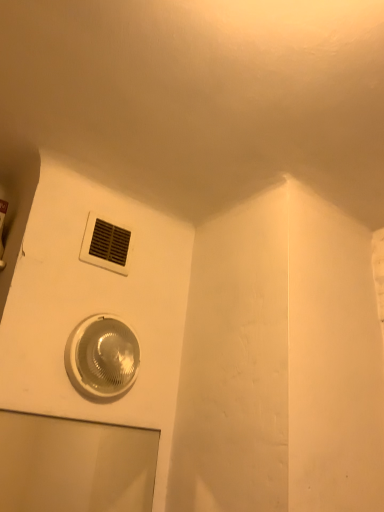
Question: Can you confirm if translucent plastic light fixture at lower center is thinner than white plastic air conditioning at upper center?

Choices:
 (A) no
 (B) yes

Answer: (A)

Question: Is translucent plastic light fixture at lower center not close to white plastic air conditioning at upper center?

Choices:
 (A) yes
 (B) no

Answer: (B)

Question: Does translucent plastic light fixture at lower center come in front of white plastic air conditioning at upper center?

Choices:
 (A) no
 (B) yes

Answer: (B)

Question: Is translucent plastic light fixture at lower center beside white plastic air conditioning at upper center?

Choices:
 (A) no
 (B) yes

Answer: (A)

Question: Is translucent plastic light fixture at lower center oriented towards white plastic air conditioning at upper center?

Choices:
 (A) yes
 (B) no

Answer: (B)

Question: Considering the relative sizes of translucent plastic light fixture at lower center and white plastic air conditioning at upper center in the image provided, is translucent plastic light fixture at lower center wider than white plastic air conditioning at upper center?

Choices:
 (A) no
 (B) yes

Answer: (B)

Question: Is white plastic air conditioning at upper center bigger than translucent plastic light fixture at lower center?

Choices:
 (A) no
 (B) yes

Answer: (A)

Question: Can you confirm if white plastic air conditioning at upper center is thinner than translucent plastic light fixture at lower center?

Choices:
 (A) yes
 (B) no

Answer: (A)

Question: From the image's perspective, is white plastic air conditioning at upper center under translucent plastic light fixture at lower center?

Choices:
 (A) yes
 (B) no

Answer: (B)

Question: Does white plastic air conditioning at upper center appear on the right side of translucent plastic light fixture at lower center?

Choices:
 (A) no
 (B) yes

Answer: (A)

Question: Is white plastic air conditioning at upper center not near translucent plastic light fixture at lower center?

Choices:
 (A) no
 (B) yes

Answer: (A)

Question: From a real-world perspective, is white plastic air conditioning at upper center located higher than translucent plastic light fixture at lower center?

Choices:
 (A) yes
 (B) no

Answer: (A)

Question: Can you see transparent glass door at lower left touching white plastic air conditioning at upper center?

Choices:
 (A) no
 (B) yes

Answer: (A)